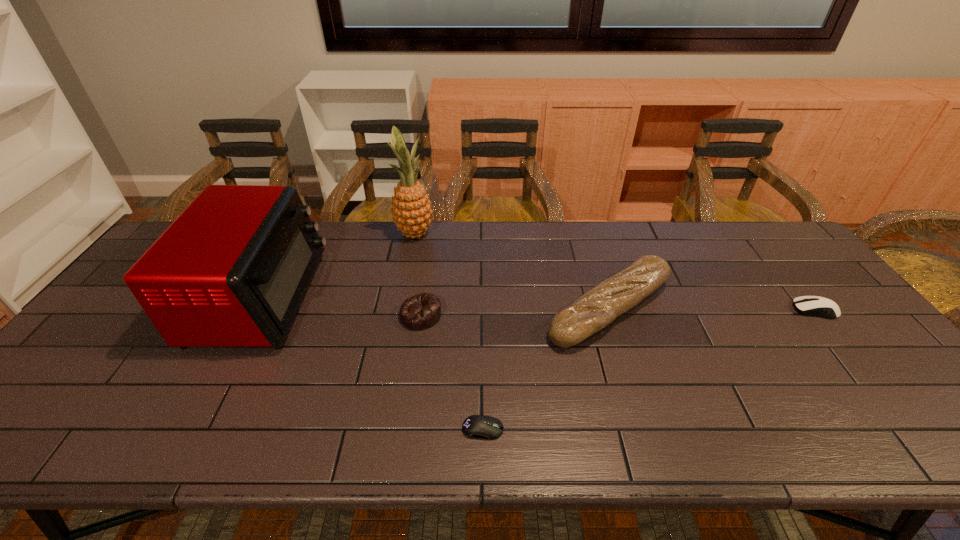
Locate an element on the screen. The width and height of the screenshot is (960, 540). object that is at the right edge is located at coordinates (817, 306).

Where is `vacant space at the far edge of the desktop`? The width and height of the screenshot is (960, 540). vacant space at the far edge of the desktop is located at coordinates (588, 242).

Where is `vacant space at the near edge of the desktop`? The image size is (960, 540). vacant space at the near edge of the desktop is located at coordinates (335, 436).

Where is `vacant space at the right edge`? The width and height of the screenshot is (960, 540). vacant space at the right edge is located at coordinates (820, 319).

Identify the location of vacant region at the near right corner. (933, 441).

Where is `vacant area that lies between the shortest object and the baguet`? This screenshot has height=540, width=960. vacant area that lies between the shortest object and the baguet is located at coordinates (546, 369).

Identify the location of free space between the farthest object and the third shortest object. (418, 275).

This screenshot has height=540, width=960. Find the location of `free point between the left computer equipment and the farthest object`. free point between the left computer equipment and the farthest object is located at coordinates (448, 332).

At what (x,y) coordinates should I click in order to perform the action: click on empty space between the pineapple and the second tallest object. Please return your answer as a coordinate pair (x, y). The height and width of the screenshot is (540, 960). Looking at the image, I should click on (338, 266).

Where is `empty space between the nearer computer equipment and the fifth shortest object`? The width and height of the screenshot is (960, 540). empty space between the nearer computer equipment and the fifth shortest object is located at coordinates (372, 363).